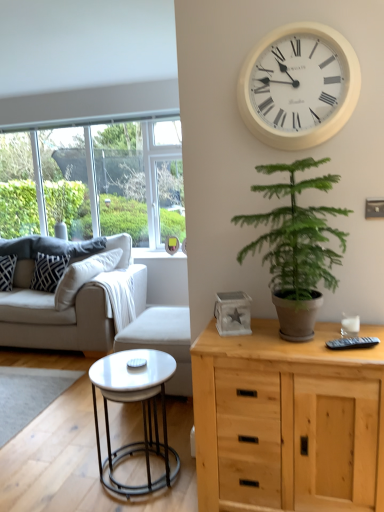
Question: From the image's perspective, is white plastic wall clock at upper center above or below natural wood cabinet at right?

Choices:
 (A) below
 (B) above

Answer: (B)

Question: Based on their positions, is white plastic wall clock at upper center located to the left or right of natural wood cabinet at right?

Choices:
 (A) left
 (B) right

Answer: (A)

Question: Estimate the real-world distances between objects in this image. Which object is closer to the green leafy plant at center-right?

Choices:
 (A) patterned fabric pillow at left, placed as the 1th pillow when sorted from left to right
 (B) black textured pillow at left, which is the second pillow from left to right
 (C) white plastic wall clock at upper center
 (D) natural wood cabinet at right
 (E) white glossy coffee table at lower left

Answer: (C)

Question: Estimate the real-world distances between objects in this image. Which object is closer to the white fabric armchair at center?

Choices:
 (A) clear glass window at left
 (B) patterned fabric pillow at left, the 2th pillow from the right
 (C) natural wood cabinet at right
 (D) black plastic remote at right
 (E) white plastic wall clock at upper center

Answer: (C)